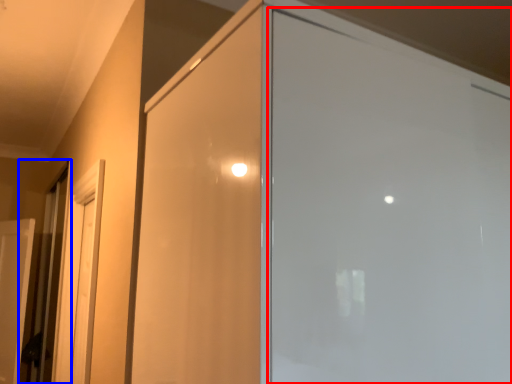
Question: Which object is further to the camera taking this photo, screen door (highlighted by a red box) or elevator (highlighted by a blue box)?

Choices:
 (A) screen door
 (B) elevator

Answer: (B)